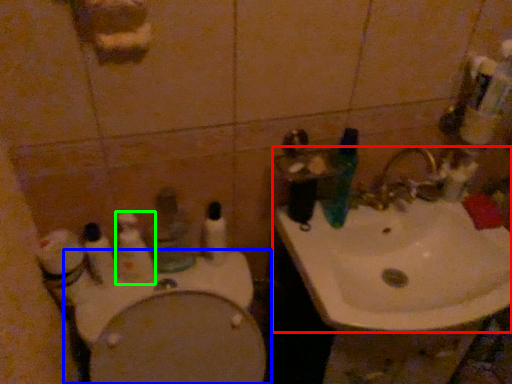
Question: Which is farther away from sink (highlighted by a red box)? toilet (highlighted by a blue box) or toothbrush (highlighted by a green box)?

Choices:
 (A) toilet
 (B) toothbrush

Answer: (B)